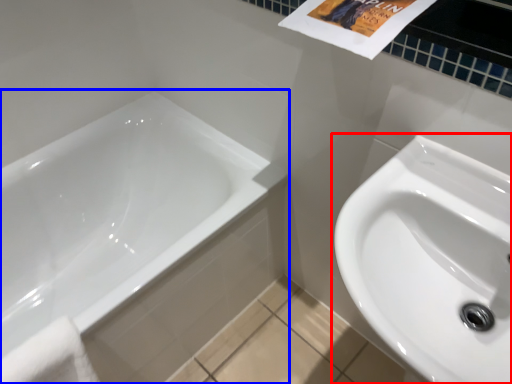
Question: Among these objects, which one is nearest to the camera, sink (highlighted by a red box) or bathtub (highlighted by a blue box)?

Choices:
 (A) sink
 (B) bathtub

Answer: (A)